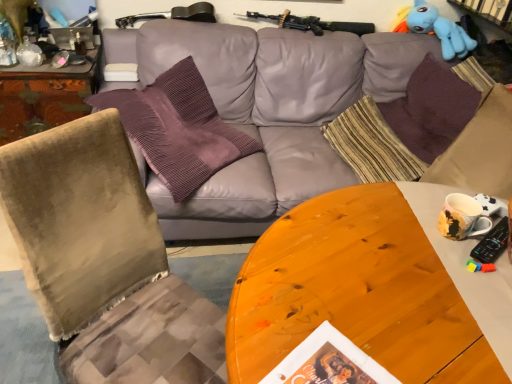
The height and width of the screenshot is (384, 512). What do you see at coordinates (440, 30) in the screenshot? I see `blue plush toy at upper right` at bounding box center [440, 30].

In order to face multicolored ceramic mug at right, should I rotate leftwards or rightwards?

You should rotate right by 26.034 degrees.

This screenshot has height=384, width=512. What do you see at coordinates (480, 150) in the screenshot?
I see `purple corduroy pillow at upper right, which is the third pillow from left to right` at bounding box center [480, 150].

Describe the element at coordinates (45, 96) in the screenshot. I see `wooden desk at left` at that location.

This screenshot has height=384, width=512. What do you see at coordinates (121, 72) in the screenshot?
I see `white matte magazine at center` at bounding box center [121, 72].

Looking at this image, measure the distance between purple knitted pillow at upper right, which appears as the fourth pillow when viewed from the left, and camera.

purple knitted pillow at upper right, which appears as the fourth pillow when viewed from the left, and camera are 6.53 feet apart from each other.

Image resolution: width=512 pixels, height=384 pixels. What do you see at coordinates (431, 109) in the screenshot? I see `purple knitted pillow at upper right, arranged as the first pillow when viewed from the right` at bounding box center [431, 109].

Locate an element on the screen. This screenshot has height=384, width=512. striped fabric pillow at center, which ranks as the second pillow in left-to-right order is located at coordinates (372, 145).

Is purple corduroy pillow at upper right, which is the third pillow from left to right, completely or partially outside of white matte magazine at center?

Absolutely, purple corduroy pillow at upper right, which is the third pillow from left to right, is external to white matte magazine at center.

Locate an element on the screen. the 2nd pillow below the white matte magazine at center (from the image's perspective) is located at coordinates (480, 150).

From a real-world perspective, is purple corduroy pillow at upper right, which appears as the second pillow when viewed from the right, physically located above or below white matte magazine at center?

purple corduroy pillow at upper right, which appears as the second pillow when viewed from the right, is below white matte magazine at center.

How different are the orientations of purple corduroy pillow at upper right, which is the third pillow from left to right, and white matte magazine at center in degrees?

92.6 degrees.

Is gray leather couch at center inside or outside of wooden desk at left?

gray leather couch at center cannot be found inside wooden desk at left.

From a real-world perspective, who is located lower, gray leather couch at center or wooden desk at left?

Result: In real-world perspective, wooden desk at left is lower.

Considering the sizes of objects gray leather couch at center and wooden desk at left in the image provided, who is shorter, gray leather couch at center or wooden desk at left?

wooden desk at left.

Which object is further away from the camera, gray leather couch at center or wooden desk at left?

wooden desk at left.

From the image's perspective, relative to white matte magazine at center, is velvet green chair at left above or below?

Clearly, from the image's perspective, velvet green chair at left is below white matte magazine at center.

Considering the sizes of velvet green chair at left and white matte magazine at center in the image, is velvet green chair at left wider or thinner than white matte magazine at center?

Considering their sizes, velvet green chair at left looks broader than white matte magazine at center.

Considering the positions of objects velvet green chair at left and white matte magazine at center in the image provided, who is behind, velvet green chair at left or white matte magazine at center?

white matte magazine at center is more distant.

Which point is more forward, [139,338] or [122,64]?

The point [139,338] is closer to the camera.

Looking at this image, from a real-world perspective, is white matte magazine at center above or below black matte rifle at upper center?

From a real-world perspective, white matte magazine at center is physically below black matte rifle at upper center.

Measure the distance between white matte magazine at center and black matte rifle at upper center.

white matte magazine at center is 36.44 inches away from black matte rifle at upper center.

Find the location of `gun on the right side of white matte magazine at center`. gun on the right side of white matte magazine at center is located at coordinates (312, 23).

Between white matte magazine at center and black matte rifle at upper center, which one has larger size?

black matte rifle at upper center is bigger.

Can you confirm if striped fabric pillow at center, which ranks as the second pillow in left-to-right order, is bigger than purple velvet pillow at upper left, the 4th pillow from the right?

No, striped fabric pillow at center, which ranks as the second pillow in left-to-right order, is not bigger than purple velvet pillow at upper left, the 4th pillow from the right.

From a real-world perspective, which pillow is the 2nd one above the striped fabric pillow at center, which ranks as the second pillow in left-to-right order? Please provide its 2D coordinates.

[(178, 128)]

Is striped fabric pillow at center, which appears as the third pillow when viewed from the right, beside purple velvet pillow at upper left, which is the first pillow from left to right?

No, striped fabric pillow at center, which appears as the third pillow when viewed from the right, is not beside purple velvet pillow at upper left, which is the first pillow from left to right.

Is purple velvet pillow at upper left, the 4th pillow from the right, next to purple knitted pillow at upper right, arranged as the first pillow when viewed from the right?

No, purple velvet pillow at upper left, the 4th pillow from the right, is not making contact with purple knitted pillow at upper right, arranged as the first pillow when viewed from the right.

Is purple knitted pillow at upper right, arranged as the first pillow when viewed from the right, surrounded by purple velvet pillow at upper left, the 4th pillow from the right?

No, purple knitted pillow at upper right, arranged as the first pillow when viewed from the right, is not surrounded by purple velvet pillow at upper left, the 4th pillow from the right.

Is point (168, 124) closer or farther from the camera than point (472, 106)?

Point (168, 124) appears to be closer to the viewer than point (472, 106).

Which object is thinner, blue plush toy at upper right or purple velvet pillow at upper left, the 4th pillow from the right?

Thinner between the two is purple velvet pillow at upper left, the 4th pillow from the right.

From the image's perspective, which object appears higher, blue plush toy at upper right or purple velvet pillow at upper left, which is the first pillow from left to right?

blue plush toy at upper right appears higher in the image.

Considering the relative positions of blue plush toy at upper right and purple velvet pillow at upper left, the 4th pillow from the right, in the image provided, is blue plush toy at upper right to the right of purple velvet pillow at upper left, the 4th pillow from the right, from the viewer's perspective?

Yes, blue plush toy at upper right is to the right of purple velvet pillow at upper left, the 4th pillow from the right.

Find the location of a particular element. The image size is (512, 384). magazine behind the purple corduroy pillow at upper right, which is the third pillow from left to right is located at coordinates (121, 72).

The image size is (512, 384). In order to click on studio couch that appears above the wooden desk at left (from a real-world perspective) in this screenshot , I will do `click(267, 111)`.

Which object lies nearer to the anchor point black matte rifle at upper center, wooden desk at left or purple corduroy pillow at upper right, which appears as the second pillow when viewed from the right?

wooden desk at left is closer to black matte rifle at upper center.

Which object lies nearer to the anchor point white matte magazine at center, wooden desk at left or black matte rifle at upper center?

wooden desk at left is closer to white matte magazine at center.

Looking at this image, based on their spatial positions, is black matte rifle at upper center or white matte magazine at center further from purple corduroy pillow at upper right, which appears as the second pillow when viewed from the right?

Based on the image, white matte magazine at center appears to be further to purple corduroy pillow at upper right, which appears as the second pillow when viewed from the right.

Considering their positions, is gray leather couch at center positioned further to blue plush toy at upper right than purple velvet pillow at upper left, the 4th pillow from the right?

purple velvet pillow at upper left, the 4th pillow from the right, lies further to blue plush toy at upper right than the other object.

Which object lies nearer to the anchor point blue plush toy at upper right, velvet green chair at left or purple knitted pillow at upper right, which appears as the fourth pillow when viewed from the left?

The object closer to blue plush toy at upper right is purple knitted pillow at upper right, which appears as the fourth pillow when viewed from the left.

Which object lies nearer to the anchor point white matte magazine at center, gray leather couch at center or purple velvet pillow at upper left, which is the first pillow from left to right?

purple velvet pillow at upper left, which is the first pillow from left to right.

Estimate the real-world distances between objects in this image. Which object is further from multicolored ceramic mug at right, black matte rifle at upper center or purple knitted pillow at upper right, arranged as the first pillow when viewed from the right?

Among the two, black matte rifle at upper center is located further to multicolored ceramic mug at right.

From the image, which object appears to be nearer to black matte rifle at upper center, blue plush toy at upper right or striped fabric pillow at center, which ranks as the second pillow in left-to-right order?

blue plush toy at upper right lies closer to black matte rifle at upper center than the other object.

Where is `gun situated between white matte magazine at center and striped fabric pillow at center, which ranks as the second pillow in left-to-right order, from left to right`? The image size is (512, 384). gun situated between white matte magazine at center and striped fabric pillow at center, which ranks as the second pillow in left-to-right order, from left to right is located at coordinates (312, 23).

You are a GUI agent. You are given a task and a screenshot of the screen. Output one action in this format:
    pyautogui.click(x=<x>, y=<y>)
    Task: Click on the gun located between purple velvet pillow at upper left, the 4th pillow from the right, and purple knitted pillow at upper right, arranged as the first pillow when viewed from the right, in the left-right direction
    
    Given the screenshot: What is the action you would take?
    pyautogui.click(x=312, y=23)

Locate an element on the screen. The width and height of the screenshot is (512, 384). pillow located between gray leather couch at center and purple corduroy pillow at upper right, which is the third pillow from left to right, in the left-right direction is located at coordinates (372, 145).

Where is `magazine situated between wooden desk at left and purple knitted pillow at upper right, arranged as the first pillow when viewed from the right, from left to right`? Image resolution: width=512 pixels, height=384 pixels. magazine situated between wooden desk at left and purple knitted pillow at upper right, arranged as the first pillow when viewed from the right, from left to right is located at coordinates (121, 72).